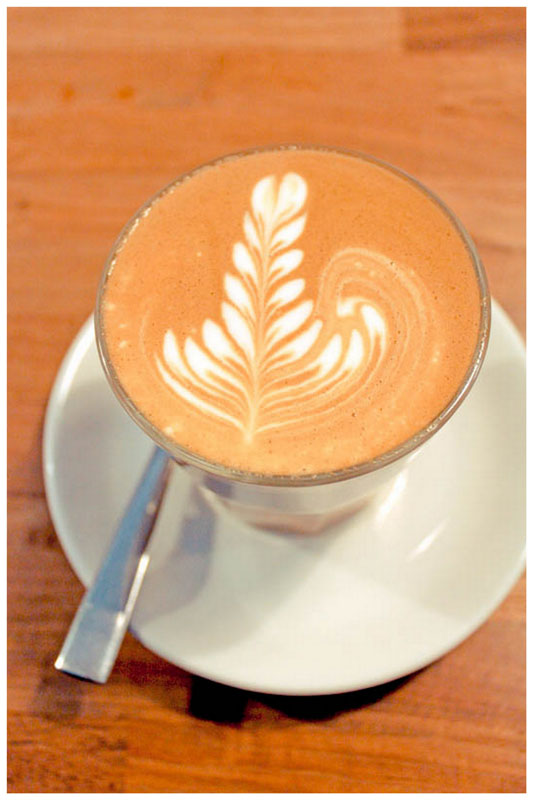
What are the coordinates of `coffee cup/mug` in the screenshot? It's located at (303, 504).